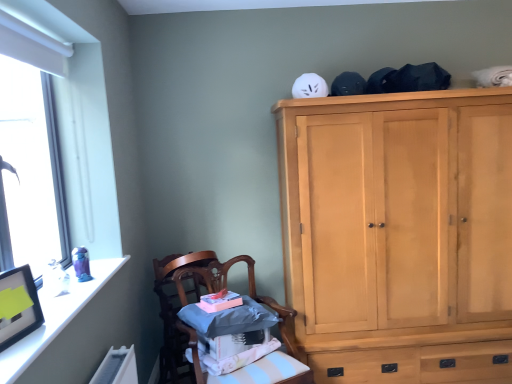
Question: Is wooden chair at lower left, which appears as the 1th chair when viewed from the front, in front of or behind wooden chair at lower left, the first chair from the back, in the image?

Choices:
 (A) behind
 (B) front

Answer: (B)

Question: Is wooden chair at lower left, acting as the second chair starting from the back, to the left or to the right of wooden chair at lower left, the first chair from the back, in the image?

Choices:
 (A) right
 (B) left

Answer: (A)

Question: Considering the real-world distances, which object is closest to the wooden chair at lower left, the first chair from the back?

Choices:
 (A) light wood cabinet at upper right
 (B) wooden chair at lower left, which appears as the 1th chair when viewed from the front
 (C) white glossy frame at upper left

Answer: (B)

Question: Which is farther from the light wood cabinet at upper right?

Choices:
 (A) white glossy frame at upper left
 (B) wooden chair at lower left, acting as the second chair starting from the back
 (C) wooden chair at lower left, the first chair from the back

Answer: (A)